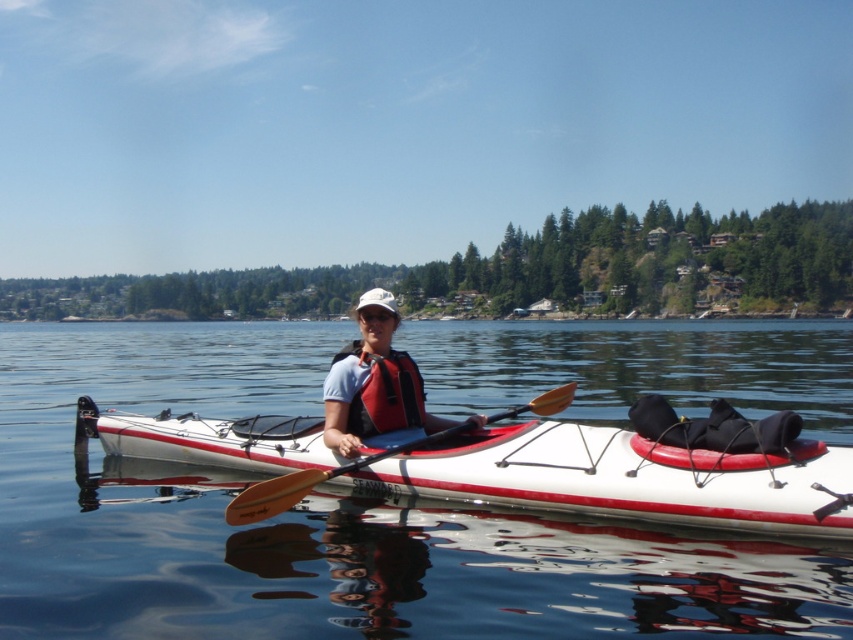
Can you confirm if transparent water at center is positioned to the left of orange life jacket at center?

Yes, transparent water at center is to the left of orange life jacket at center.

In the scene shown: Who is taller, transparent water at center or orange life jacket at center?

With more height is transparent water at center.

Where is `transparent water at center`? This screenshot has width=853, height=640. transparent water at center is located at coordinates (328, 522).

Can you confirm if transparent water at center is thinner than wooden smooth paddle at center?

No.

Who is positioned more to the left, transparent water at center or wooden smooth paddle at center?

transparent water at center is more to the left.

Describe the element at coordinates (328, 522) in the screenshot. I see `transparent water at center` at that location.

Identify the location of transparent water at center. This screenshot has height=640, width=853. (328, 522).

Which of these two, orange life jacket at center or wooden smooth paddle at center, stands taller?

orange life jacket at center is taller.

Does orange life jacket at center appear under wooden smooth paddle at center?

Incorrect, orange life jacket at center is not positioned below wooden smooth paddle at center.

Who is more forward, (351,340) or (285,486)?

Positioned in front is point (285,486).

Identify the location of orange life jacket at center. (383, 392).